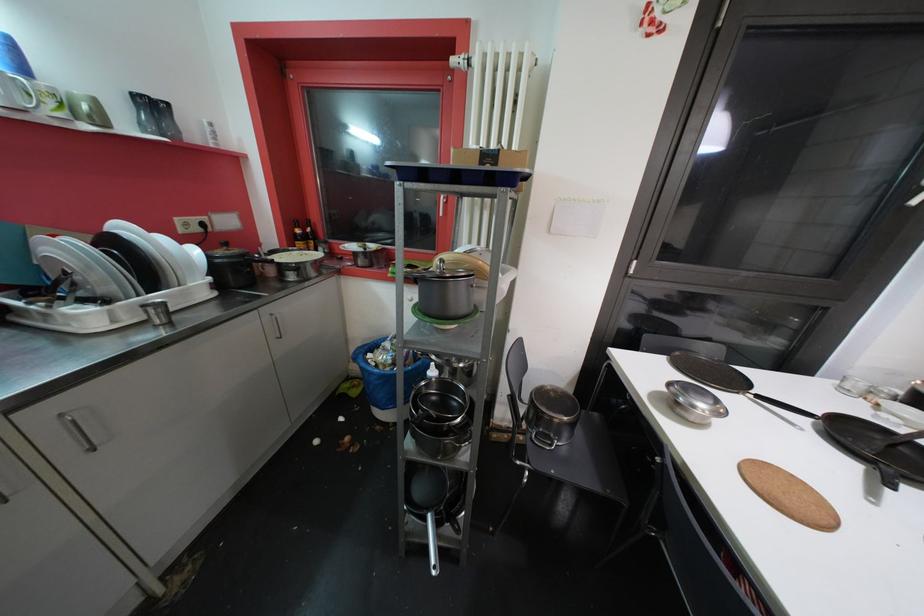
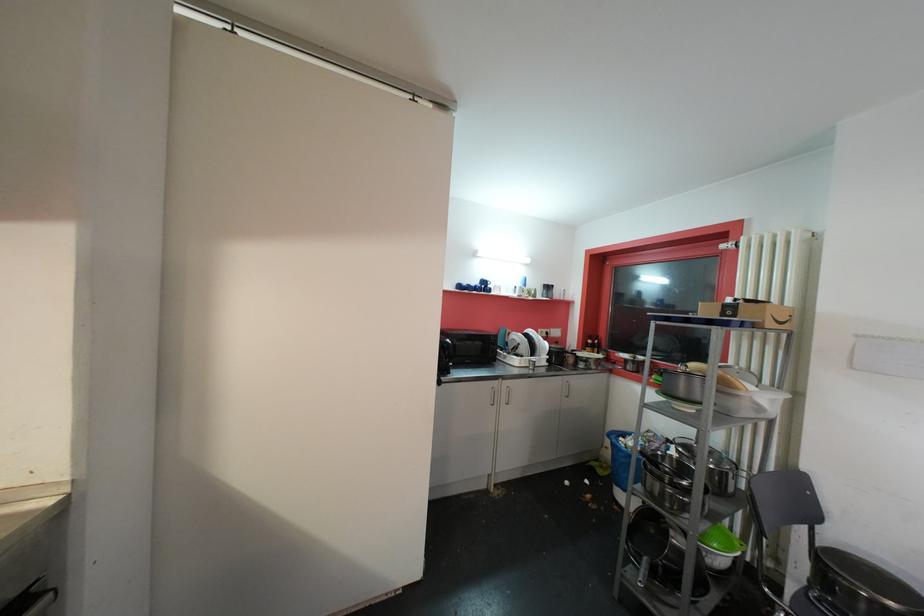
Find the pixel in the second image that matches (368,367) in the first image.

(619, 443)